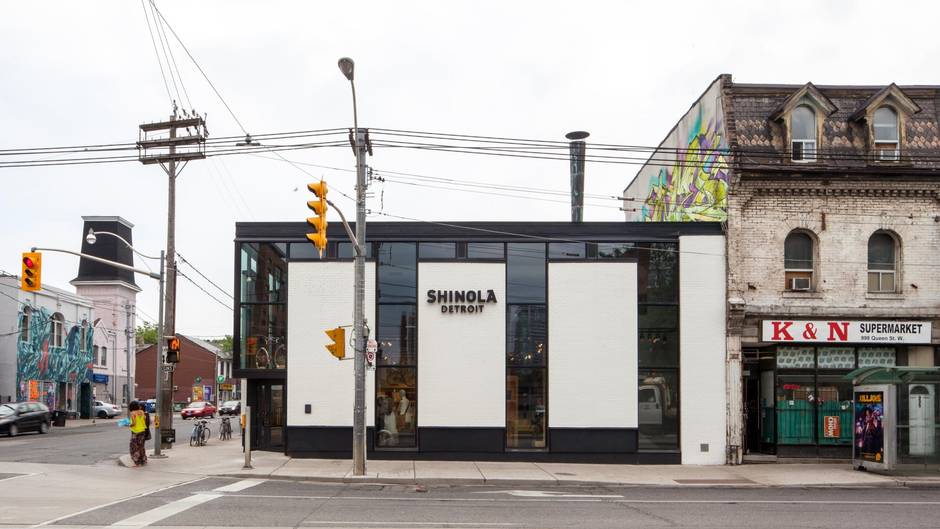
Locate an element on the screen. electrical wires is located at coordinates (64, 156), (319, 140), (473, 147), (621, 145).